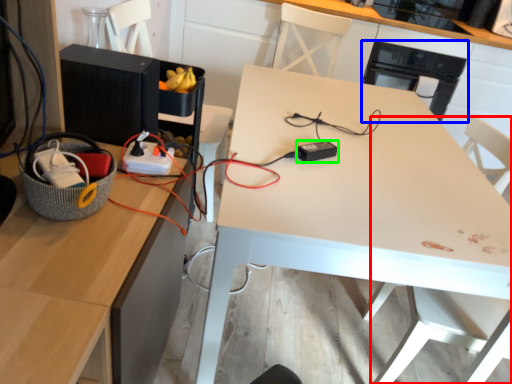
Question: Considering the real-world distances, which object is closest to swivel chair (highlighted by a red box)? appliance (highlighted by a blue box) or appliance (highlighted by a green box).

Choices:
 (A) appliance
 (B) appliance

Answer: (B)